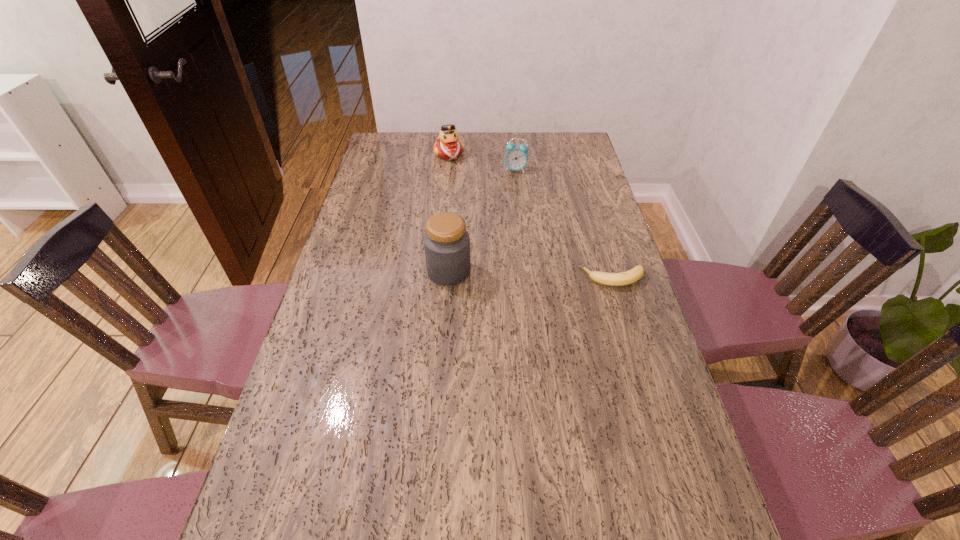
The height and width of the screenshot is (540, 960). In order to click on blank area at the far edge in this screenshot , I will do `click(434, 153)`.

In the image, there is a desktop. Where is `vacant space at the near edge`? Image resolution: width=960 pixels, height=540 pixels. vacant space at the near edge is located at coordinates (352, 525).

I want to click on vacant space at the left edge of the desktop, so click(x=358, y=311).

Find the location of `free space at the right edge of the desktop`. free space at the right edge of the desktop is located at coordinates (559, 186).

Image resolution: width=960 pixels, height=540 pixels. In order to click on vacant space at the near right corner of the desktop in this screenshot , I will do (x=655, y=494).

Find the location of a particular element. This screenshot has width=960, height=540. vacant region between the third nearest object and the duck is located at coordinates (482, 162).

Where is `unoccupied position between the banana and the tallest object`? unoccupied position between the banana and the tallest object is located at coordinates (531, 274).

Locate an element on the screen. free space between the farthest object and the second object from right to left is located at coordinates (482, 162).

The image size is (960, 540). In order to click on free point between the banana and the third object from left to right in this screenshot , I will do `click(564, 224)`.

Where is `free point between the rightmost object and the duck`? Image resolution: width=960 pixels, height=540 pixels. free point between the rightmost object and the duck is located at coordinates (531, 216).